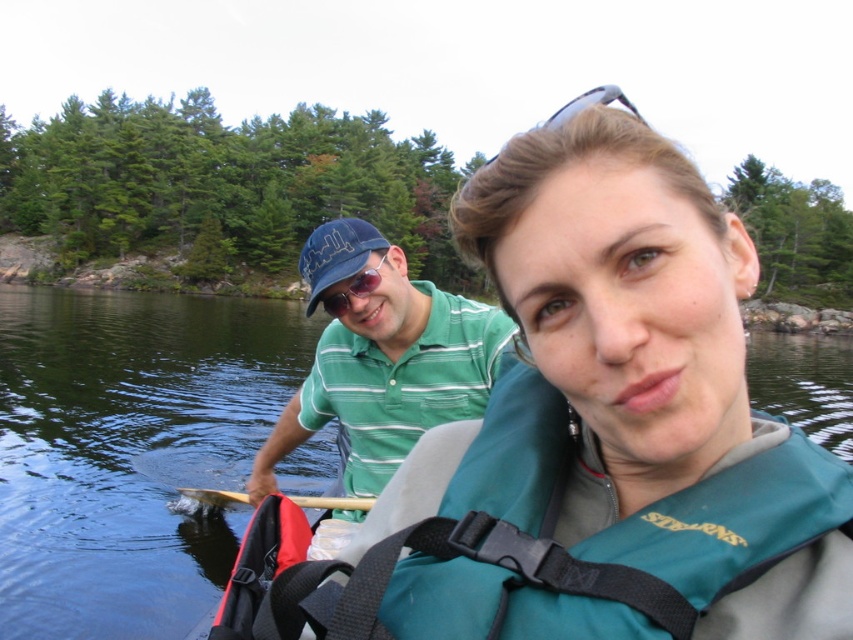
You are a photographer trying to capture the exact position of the brown wood paddle at lower center in the image. According to the coordinates provided, where would you focus your camera to ensure the paddle is centered?

The brown wood paddle at lower center is located at point (334, 502), so you should focus your camera at those coordinates to center it.

You are standing at the edge of the water and see two points marked in the image. Which point, point (492, 458) or point (328, 508), is closer to you?

Point (492, 458) is closer to the viewer than point (328, 508).

You are standing on a dock and see the green water at center and the sunglasses at upper center in the distance. If you want to throw a rope to retrieve an item, which one is farther from you?

The sunglasses at upper center are farther away from you since they are 17.33 meters apart from the green water at center, implying they are further in the distance.